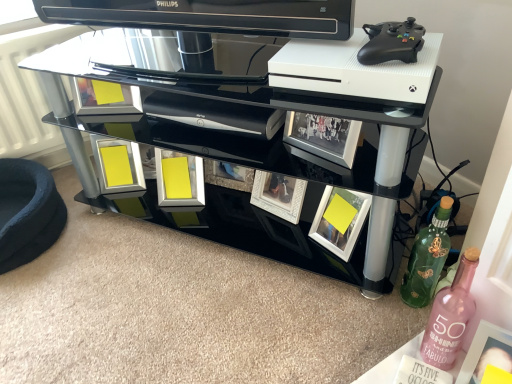
Question: From the image's perspective, is yellow matte picture frame at lower right, which is counted as the 1th picture frame, starting from the front, on black glass tv stand at center?

Choices:
 (A) yes
 (B) no

Answer: (B)

Question: Is yellow matte picture frame at lower right, acting as the 5th picture frame starting from the back, bigger than black glass tv stand at center?

Choices:
 (A) yes
 (B) no

Answer: (B)

Question: Is yellow matte picture frame at lower right, which appears as the 5th picture frame when viewed from the left, placed right next to black glass tv stand at center?

Choices:
 (A) yes
 (B) no

Answer: (B)

Question: From a real-world perspective, is yellow matte picture frame at lower right, acting as the 5th picture frame starting from the back, on black glass tv stand at center?

Choices:
 (A) yes
 (B) no

Answer: (B)

Question: Is the position of yellow matte picture frame at lower right, acting as the 5th picture frame starting from the back, more distant than that of black glass tv stand at center?

Choices:
 (A) yes
 (B) no

Answer: (B)

Question: Is yellow matte picture frame at lower right, marked as the 1th picture frame in a right-to-left arrangement, in front of black glass tv stand at center?

Choices:
 (A) yes
 (B) no

Answer: (A)

Question: Considering the relative sizes of pink glass bottle at lower right, the 1th bottle when ordered from front to back, and green matte bottle at lower right, the first bottle viewed from the back, in the image provided, is pink glass bottle at lower right, the 1th bottle when ordered from front to back, shorter than green matte bottle at lower right, the first bottle viewed from the back,?

Choices:
 (A) yes
 (B) no

Answer: (A)

Question: Is the surface of pink glass bottle at lower right, the 1th bottle when ordered from front to back, in direct contact with green matte bottle at lower right, the first bottle viewed from the back?

Choices:
 (A) no
 (B) yes

Answer: (A)

Question: Is pink glass bottle at lower right, which is counted as the second bottle, starting from the back, in front of green matte bottle at lower right, acting as the second bottle starting from the front?

Choices:
 (A) yes
 (B) no

Answer: (A)

Question: Is green matte bottle at lower right, acting as the second bottle starting from the front, surrounded by pink glass bottle at lower right, which is counted as the second bottle, starting from the back?

Choices:
 (A) no
 (B) yes

Answer: (A)

Question: Is pink glass bottle at lower right, the 1th bottle when ordered from front to back, wider than green matte bottle at lower right, acting as the second bottle starting from the front?

Choices:
 (A) yes
 (B) no

Answer: (B)

Question: Is pink glass bottle at lower right, the 1th bottle when ordered from front to back, not within green matte bottle at lower right, acting as the second bottle starting from the front?

Choices:
 (A) no
 (B) yes

Answer: (B)

Question: Is yellow matte picture frame at lower right, the 2th picture frame when ordered from right to left, further to the viewer compared to yellow matte picture frame at lower right, which appears as the 5th picture frame when viewed from the left?

Choices:
 (A) yes
 (B) no

Answer: (A)